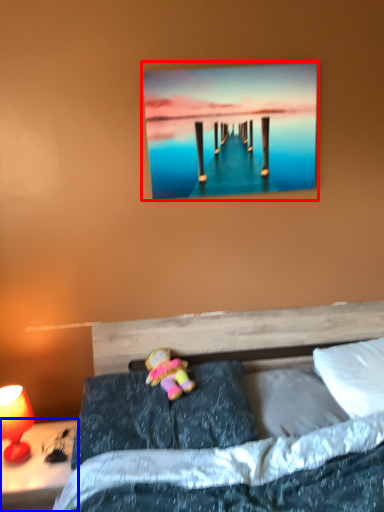
Question: Which object is closer to the camera taking this photo, picture frame (highlighted by a red box) or nightstand (highlighted by a blue box)?

Choices:
 (A) picture frame
 (B) nightstand

Answer: (B)